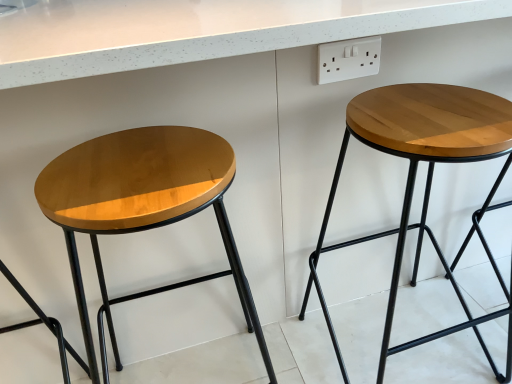
The width and height of the screenshot is (512, 384). I want to click on vacant area that is situated to the right of white plastic socket at upper right, so click(428, 89).